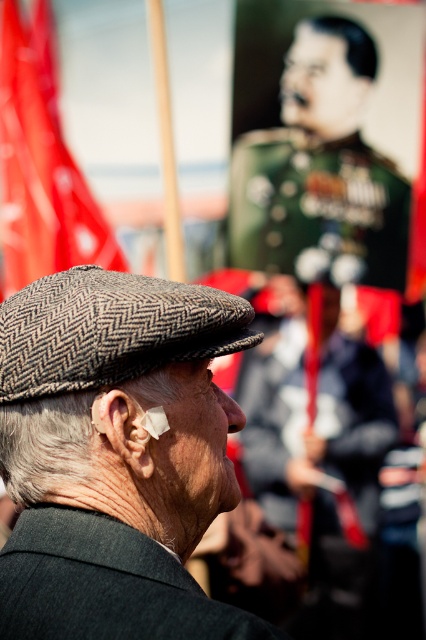
Question: Is green military uniform at upper center positioned before dark gray woolen suit at center?

Choices:
 (A) yes
 (B) no

Answer: (B)

Question: Is dark gray woolen suit at center to the left of red fabric flag at upper left from the viewer's perspective?

Choices:
 (A) no
 (B) yes

Answer: (A)

Question: Which point is closer to the camera taking this photo?

Choices:
 (A) (100, 556)
 (B) (296, 122)

Answer: (A)

Question: Is the position of gray herringbone flat cap at center less distant than that of dark gray woolen suit at center?

Choices:
 (A) yes
 (B) no

Answer: (B)

Question: Which object is closer to the camera taking this photo?

Choices:
 (A) dark gray woolen suit at center
 (B) gray herringbone flat cap at center
 (C) green military uniform at upper center
 (D) herringbone fabric hat at center

Answer: (A)

Question: Considering the real-world distances, which object is farthest from the dark gray woolen suit at center?

Choices:
 (A) green military uniform at upper center
 (B) red fabric flag at upper left
 (C) herringbone fabric hat at center

Answer: (A)